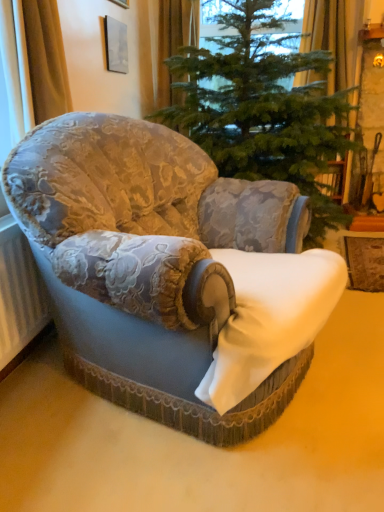
The image size is (384, 512). I want to click on free space to the right of white textured radiator at lower left, so click(66, 388).